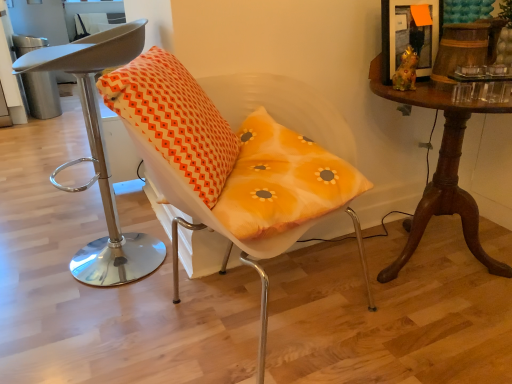
Locate an element on the screen. wooden picture frame at upper right is located at coordinates (408, 35).

Where is `mahogany wood table at right`? mahogany wood table at right is located at coordinates (441, 172).

What do you see at coordinates (225, 165) in the screenshot?
I see `matte orange cushion at center, the first chair positioned from the right` at bounding box center [225, 165].

Identify the location of wooden picture frame at upper right. This screenshot has width=512, height=384. point(408,35).

Between orange printed cushion at center and mahogany wood table at right, which one is positioned in front?

Positioned in front is orange printed cushion at center.

Between orange printed cushion at center and mahogany wood table at right, which one has smaller size?

With smaller size is orange printed cushion at center.

Does point (212, 152) come farther from viewer compared to point (471, 208)?

That is False.

From the image's perspective, would you say matte gray stool at left, which is counted as the first chair, starting from the left, is shown under orange printed cushion at center?

Yes, from the image's perspective, matte gray stool at left, which is counted as the first chair, starting from the left, is below orange printed cushion at center.

Between matte gray stool at left, which is counted as the first chair, starting from the left, and orange printed cushion at center, which one is positioned behind?

Positioned behind is matte gray stool at left, which is counted as the first chair, starting from the left.

Considering the relative sizes of matte gray stool at left, the second chair viewed from the right, and orange printed cushion at center in the image provided, is matte gray stool at left, the second chair viewed from the right, smaller than orange printed cushion at center?

Actually, matte gray stool at left, the second chair viewed from the right, might be larger than orange printed cushion at center.

From a real-world perspective, which object stands above the other?

orange printed cushion at center is physically above.

Considering the relative sizes of orange printed cushion at center and matte gray stool at left, which is counted as the first chair, starting from the left, in the image provided, is orange printed cushion at center taller than matte gray stool at left, which is counted as the first chair, starting from the left,?

No, orange printed cushion at center is not taller than matte gray stool at left, which is counted as the first chair, starting from the left.

Who is more distant, orange printed cushion at center or matte gray stool at left, which is counted as the first chair, starting from the left?

matte gray stool at left, which is counted as the first chair, starting from the left, is further away from the camera.

In the scene shown: Is there a large distance between orange printed cushion at center and matte gray stool at left, which is counted as the first chair, starting from the left?

That's not correct — orange printed cushion at center is a little close to matte gray stool at left, which is counted as the first chair, starting from the left.

Can you confirm if mahogany wood table at right is positioned to the left of matte gray stool at left, which is counted as the first chair, starting from the left?

In fact, mahogany wood table at right is to the right of matte gray stool at left, which is counted as the first chair, starting from the left.

From a real-world perspective, which object stands above the other?

matte gray stool at left, which is counted as the first chair, starting from the left, is physically above.

Considering the relative sizes of mahogany wood table at right and matte gray stool at left, the second chair viewed from the right, in the image provided, is mahogany wood table at right shorter than matte gray stool at left, the second chair viewed from the right,?

Yes, mahogany wood table at right is shorter than matte gray stool at left, the second chair viewed from the right.

Between mahogany wood table at right and orange printed cushion at center, which one appears on the right side from the viewer's perspective?

Positioned to the right is mahogany wood table at right.

Consider the image. Measure the distance between mahogany wood table at right and orange printed cushion at center.

The distance of mahogany wood table at right from orange printed cushion at center is 28.30 inches.

Between mahogany wood table at right and orange printed cushion at center, which one has smaller width?

orange printed cushion at center.

How many degrees apart are the facing directions of mahogany wood table at right and orange printed cushion at center?

They differ by 20.7 degrees in their facing directions.

Between point (119, 79) and point (167, 72), which one is positioned behind?

The point (167, 72) is farther.

From a real-world perspective, is matte orange cushion at center, arranged as the 2th chair when viewed from the left, positioned under orange printed cushion at center based on gravity?

Indeed, from a real-world perspective, matte orange cushion at center, arranged as the 2th chair when viewed from the left, is positioned beneath orange printed cushion at center.

What's the angular difference between matte orange cushion at center, the first chair positioned from the right, and orange printed cushion at center's facing directions?

matte orange cushion at center, the first chair positioned from the right, and orange printed cushion at center are facing 33 degrees away from each other.

Can you confirm if matte orange cushion at center, arranged as the 2th chair when viewed from the left, is positioned to the right of orange printed cushion at center?

Yes.

Which chair is the 2nd one when counting from the front of the wooden picture frame at upper right? Please provide its 2D coordinates.

[(225, 165)]

Can we say matte orange cushion at center, arranged as the 2th chair when viewed from the left, lies outside wooden picture frame at upper right?

Yes, matte orange cushion at center, arranged as the 2th chair when viewed from the left, is not within wooden picture frame at upper right.

From a real-world perspective, is matte orange cushion at center, the first chair positioned from the right, under wooden picture frame at upper right?

Yes, from a real-world perspective, matte orange cushion at center, the first chair positioned from the right, is below wooden picture frame at upper right.

The image size is (512, 384). What are the coordinates of `pillow in front of the mahogany wood table at right` in the screenshot? It's located at (174, 119).

Locate an element on the screen. pillow above the matte gray stool at left, which is counted as the first chair, starting from the left (from the image's perspective) is located at coordinates (174, 119).

Based on their spatial positions, is mahogany wood table at right or wooden picture frame at upper right further from orange printed cushion at center?

Among the two, wooden picture frame at upper right is located further to orange printed cushion at center.

Looking at the image, which one is located further to mahogany wood table at right, orange printed cushion at center or matte orange cushion at center, arranged as the 2th chair when viewed from the left?

Based on the image, orange printed cushion at center appears to be further to mahogany wood table at right.

Which object lies nearer to the anchor point orange printed cushion at center, matte orange cushion at center, the first chair positioned from the right, or mahogany wood table at right?

matte orange cushion at center, the first chair positioned from the right, lies closer to orange printed cushion at center than the other object.

Which object lies further to the anchor point orange printed cushion at center, matte gray stool at left, the second chair viewed from the right, or matte orange cushion at center, the first chair positioned from the right?

Among the two, matte gray stool at left, the second chair viewed from the right, is located further to orange printed cushion at center.

Which object lies further to the anchor point mahogany wood table at right, matte orange cushion at center, arranged as the 2th chair when viewed from the left, or wooden picture frame at upper right?

The object further to mahogany wood table at right is matte orange cushion at center, arranged as the 2th chair when viewed from the left.

Based on their spatial positions, is wooden picture frame at upper right or matte orange cushion at center, arranged as the 2th chair when viewed from the left, closer to matte gray stool at left, which is counted as the first chair, starting from the left?

matte orange cushion at center, arranged as the 2th chair when viewed from the left, lies closer to matte gray stool at left, which is counted as the first chair, starting from the left, than the other object.

When comparing their distances from orange printed cushion at center, does matte orange cushion at center, the first chair positioned from the right, or matte gray stool at left, the second chair viewed from the right, seem further?

A: matte gray stool at left, the second chair viewed from the right.

Estimate the real-world distances between objects in this image. Which object is closer to orange printed cushion at center, wooden picture frame at upper right or mahogany wood table at right?

mahogany wood table at right is positioned closer to the anchor orange printed cushion at center.

The image size is (512, 384). What are the coordinates of `picture frame between matte orange cushion at center, the first chair positioned from the right, and mahogany wood table at right, in the horizontal direction` in the screenshot? It's located at (408, 35).

Locate an element on the screen. The width and height of the screenshot is (512, 384). chair between orange printed cushion at center and wooden picture frame at upper right in the horizontal direction is located at coordinates (225, 165).

Find the location of a particular element. The height and width of the screenshot is (384, 512). picture frame situated between orange printed cushion at center and mahogany wood table at right from left to right is located at coordinates (408, 35).

You are a GUI agent. You are given a task and a screenshot of the screen. Output one action in this format:
    pyautogui.click(x=<x>, y=<y>)
    Task: Click on the chair located between matte gray stool at left, the second chair viewed from the right, and mahogany wood table at right in the left-right direction
    The width and height of the screenshot is (512, 384).
    Given the screenshot: What is the action you would take?
    [x=225, y=165]